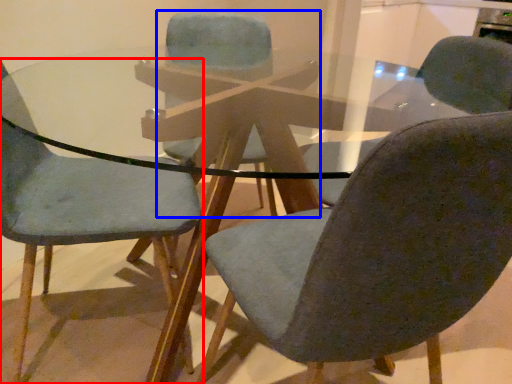
Question: Which object is closer to the camera taking this photo, chair (highlighted by a red box) or chair (highlighted by a blue box)?

Choices:
 (A) chair
 (B) chair

Answer: (A)